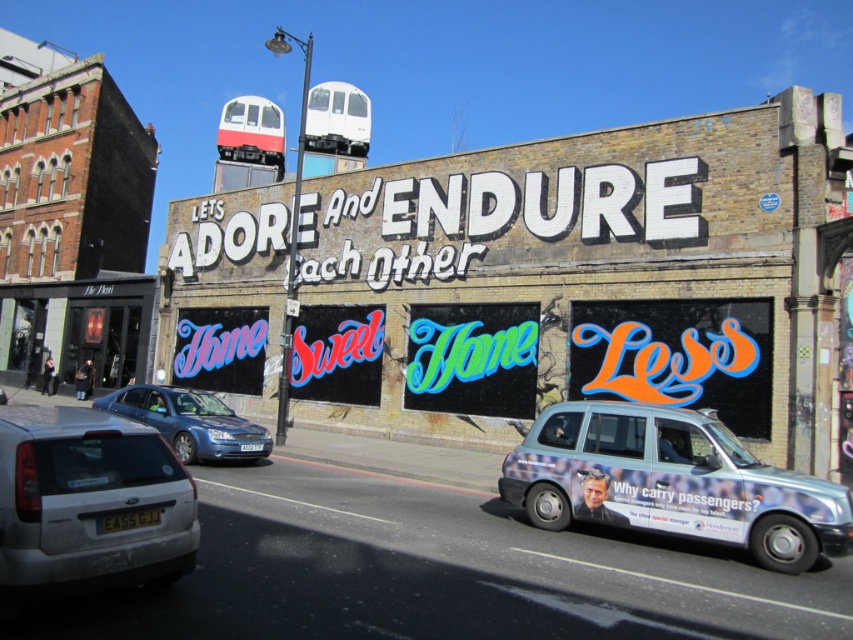
From the picture: Does silver metallic hatchback at lower left have a lesser width compared to blue metallic sedan at center?

Correct, silver metallic hatchback at lower left's width is less than blue metallic sedan at center's.

Image resolution: width=853 pixels, height=640 pixels. I want to click on silver metallic hatchback at lower left, so click(88, 502).

Is silver metallic taxi at lower right below silver metallic hatchback at lower left?

Yes.

Which is below, silver metallic taxi at lower right or silver metallic hatchback at lower left?

Positioned lower is silver metallic taxi at lower right.

Does point (787, 516) lie behind point (126, 481)?

Yes, it is.

Image resolution: width=853 pixels, height=640 pixels. In order to click on silver metallic taxi at lower right in this screenshot , I will do `click(672, 483)`.

Does silver metallic taxi at lower right come behind blue metallic sedan at center?

That is False.

Does silver metallic taxi at lower right have a lesser height compared to blue metallic sedan at center?

Correct, silver metallic taxi at lower right is not as tall as blue metallic sedan at center.

Between point (692, 451) and point (206, 429), which one is positioned behind?

Point (206, 429)

The height and width of the screenshot is (640, 853). Identify the location of silver metallic taxi at lower right. tap(672, 483).